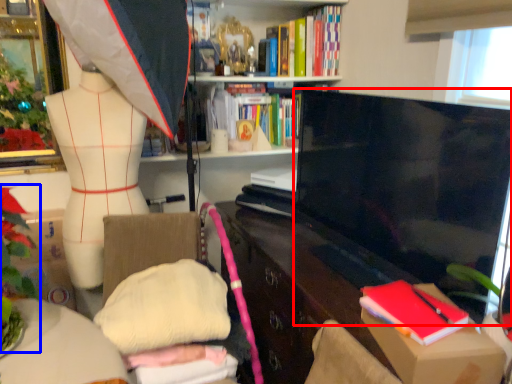
Question: Which of the following is the farthest to the observer, television (highlighted by a red box) or floral arrangement (highlighted by a blue box)?

Choices:
 (A) television
 (B) floral arrangement

Answer: (A)